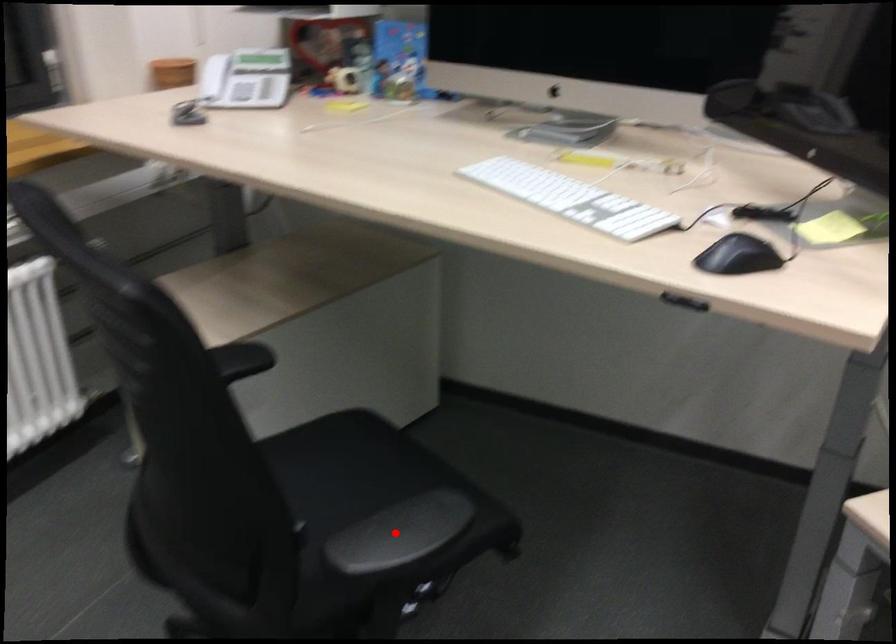
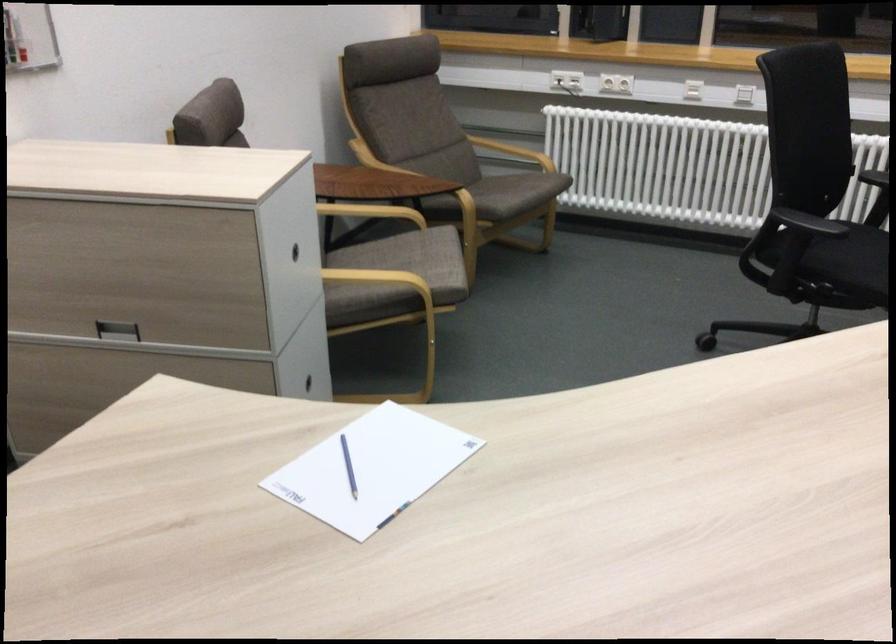
Question: I am providing you with two images of the same scene from different viewpoints. Image1 has a red point marked. In image2, the corresponding 3D location appears at what relative position? Reply with the corresponding letter.

Choices:
 (A) Closer
 (B) Farther

Answer: (B)